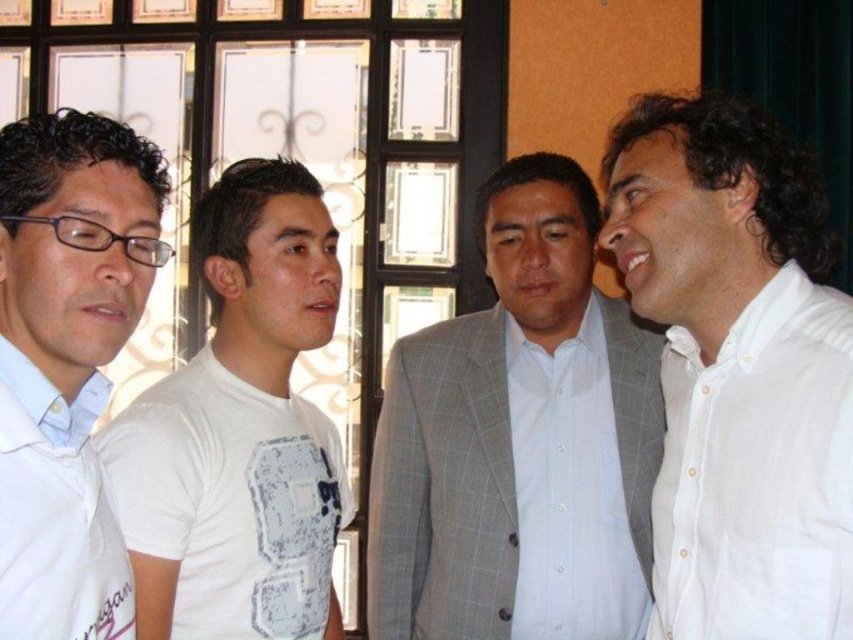
Question: Which object is the farthest from the white cotton t-shirt at left?

Choices:
 (A) light gray checkered suit at center
 (B) white cotton shirt at right

Answer: (B)

Question: From the image, what is the correct spatial relationship of white cotton shirt at right in relation to white shirt at left?

Choices:
 (A) above
 (B) below

Answer: (A)

Question: Which is farther from the white cotton shirt at right?

Choices:
 (A) white cotton t-shirt at left
 (B) white shirt at left

Answer: (B)

Question: Which point is closer to the camera?

Choices:
 (A) (780, 488)
 (B) (100, 268)

Answer: (B)

Question: Does white cotton shirt at right appear on the left side of white cotton t-shirt at left?

Choices:
 (A) yes
 (B) no

Answer: (B)

Question: Can you confirm if white cotton shirt at right is thinner than white cotton t-shirt at left?

Choices:
 (A) no
 (B) yes

Answer: (B)